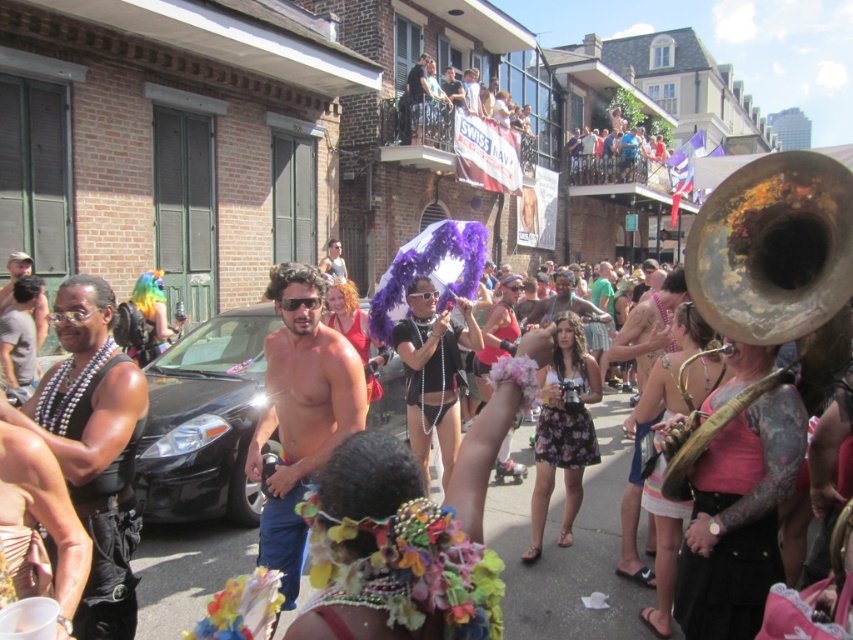
Question: Which point is closer to the camera taking this photo?

Choices:
 (A) (827, 230)
 (B) (422, 67)
 (C) (183, 369)

Answer: (A)

Question: Is gold tarnished trumpet at center further to camera compared to black matte car at center?

Choices:
 (A) no
 (B) yes

Answer: (A)

Question: Is black leather vest at center wider than black matte car at center?

Choices:
 (A) yes
 (B) no

Answer: (B)

Question: Which object is positioned closest to the gold tarnished trumpet at center?

Choices:
 (A) shiny gold necklace at center
 (B) shiny blue shorts at center
 (C) black matte car at center

Answer: (B)

Question: Among these objects, which one is nearest to the camera?

Choices:
 (A) shiny black tank top at upper center
 (B) shiny blue shorts at center
 (C) shiny gold necklace at center
 (D) black matte car at center

Answer: (B)

Question: Is black leather vest at center to the right of shiny black tank top at upper center from the viewer's perspective?

Choices:
 (A) yes
 (B) no

Answer: (B)